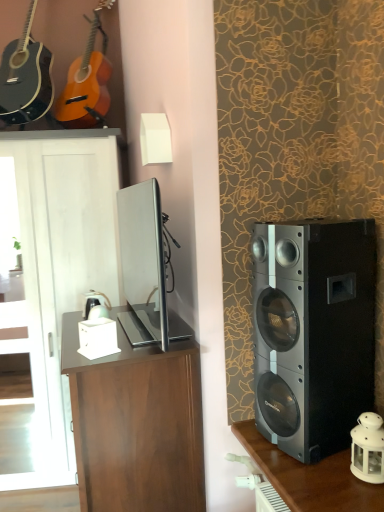
Question: Is point (354, 315) closer or farther from the camera than point (155, 426)?

Choices:
 (A) farther
 (B) closer

Answer: (B)

Question: Is black metallic speaker at right to the left or to the right of brown wood desk at center in the image?

Choices:
 (A) left
 (B) right

Answer: (B)

Question: Which object is the farthest from the satin silver tv at center?

Choices:
 (A) brown wood cabinet at left
 (B) white glass lantern at lower right
 (C) matte wood guitar at upper left, arranged as the first guitar when viewed from the right
 (D) black metallic speaker at right
 (E) dark wood shelf at right

Answer: (B)

Question: Estimate the real-world distances between objects in this image. Which object is farther from the black metallic speaker at right?

Choices:
 (A) satin silver tv at center
 (B) white glass lantern at lower right
 (C) brown wood cabinet at left
 (D) matte wood guitar at upper left, which appears as the 2th guitar when viewed from the left
 (E) brown wood desk at center

Answer: (D)